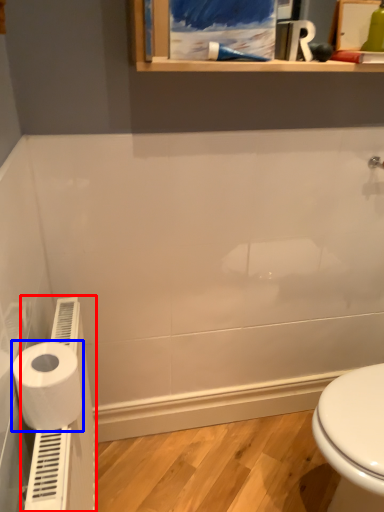
Question: Which object appears farthest to the camera in this image, water heater (highlighted by a red box) or toilet paper (highlighted by a blue box)?

Choices:
 (A) water heater
 (B) toilet paper

Answer: (B)